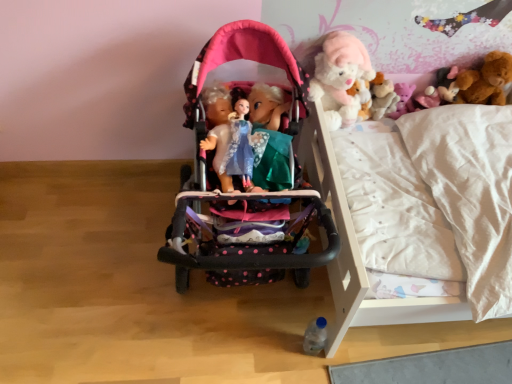
Question: Is the depth of white wooden bunk bed at center less than that of clear plastic bottle at lower center, the first toy positioned from the left?

Choices:
 (A) no
 (B) yes

Answer: (B)

Question: Is white wooden bunk bed at center turned away from clear plastic bottle at lower center, marked as the 4th toy in a right-to-left arrangement?

Choices:
 (A) no
 (B) yes

Answer: (B)

Question: Could you tell me if white wooden bunk bed at center is turned towards clear plastic bottle at lower center, marked as the 4th toy in a right-to-left arrangement?

Choices:
 (A) no
 (B) yes

Answer: (A)

Question: From the image's perspective, would you say white wooden bunk bed at center is shown under clear plastic bottle at lower center, the first toy positioned from the left?

Choices:
 (A) no
 (B) yes

Answer: (A)

Question: Can you see white wooden bunk bed at center touching clear plastic bottle at lower center, which appears as the first toy when ordered from the bottom?

Choices:
 (A) yes
 (B) no

Answer: (B)

Question: In terms of size, does white wooden bunk bed at center appear bigger or smaller than matte pink stroller at center?

Choices:
 (A) small
 (B) big

Answer: (B)

Question: Visually, is white wooden bunk bed at center positioned to the left or to the right of matte pink stroller at center?

Choices:
 (A) right
 (B) left

Answer: (B)

Question: Is point (257, 36) positioned closer to the camera than point (282, 147)?

Choices:
 (A) closer
 (B) farther

Answer: (B)

Question: In terms of width, does white wooden bunk bed at center look wider or thinner when compared to matte pink stroller at center?

Choices:
 (A) wide
 (B) thin

Answer: (A)

Question: From the image's perspective, is white wooden bunk bed at center positioned above or below clear plastic bottle at lower center, marked as the 4th toy in a right-to-left arrangement?

Choices:
 (A) above
 (B) below

Answer: (A)

Question: In the image, is white wooden bunk bed at center positioned in front of or behind clear plastic bottle at lower center, the fourth toy when ordered from top to bottom?

Choices:
 (A) behind
 (B) front

Answer: (B)

Question: Is white wooden bunk bed at center situated inside clear plastic bottle at lower center, the first toy positioned from the left, or outside?

Choices:
 (A) inside
 (B) outside

Answer: (B)

Question: Based on their sizes in the image, would you say white wooden bunk bed at center is bigger or smaller than clear plastic bottle at lower center, the first toy positioned from the left?

Choices:
 (A) big
 (B) small

Answer: (A)

Question: From a real-world perspective, is white wooden bunk bed at center above or below pink plush bear at upper right, the 2th toy positioned from the bottom?

Choices:
 (A) above
 (B) below

Answer: (B)

Question: Is white wooden bunk bed at center bigger or smaller than pink plush bear at upper right, the third toy in the left-to-right sequence?

Choices:
 (A) small
 (B) big

Answer: (B)